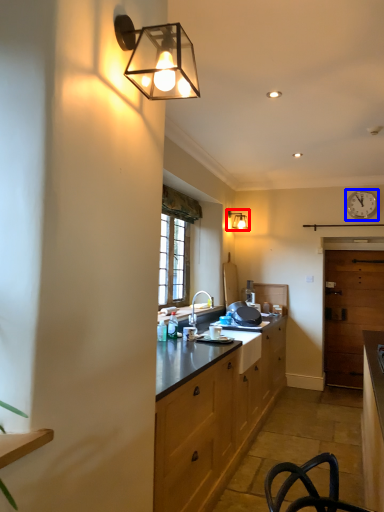
Question: Which of the following is the closest to the observer, lamp (highlighted by a red box) or clock (highlighted by a blue box)?

Choices:
 (A) lamp
 (B) clock

Answer: (B)